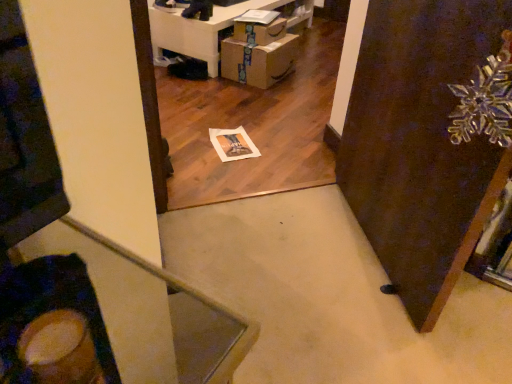
Question: Based on their positions, is cardboard boxes at lower center located to the left or right of brown cardboard drawer at center?

Choices:
 (A) right
 (B) left

Answer: (B)

Question: Considering their positions, is cardboard boxes at lower center located in front of or behind brown cardboard drawer at center?

Choices:
 (A) front
 (B) behind

Answer: (B)

Question: Estimate the real-world distances between objects in this image. Which object is closer to the metallic gold swivel chair at lower left?

Choices:
 (A) cardboard box at center
 (B) brown cardboard drawer at center
 (C) transparent glass snowflake at upper right
 (D) cardboard boxes at lower center

Answer: (C)

Question: Estimate the real-world distances between objects in this image. Which object is farther from the brown cardboard drawer at center?

Choices:
 (A) metallic gold swivel chair at lower left
 (B) transparent glass snowflake at upper right
 (C) cardboard boxes at lower center
 (D) cardboard box at center

Answer: (A)